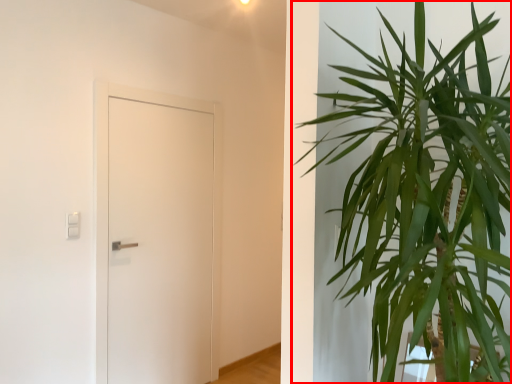
Question: Considering the relative positions of houseplant (annotated by the red box) and door in the image provided, where is houseplant (annotated by the red box) located with respect to the staircase?

Choices:
 (A) left
 (B) right

Answer: (B)